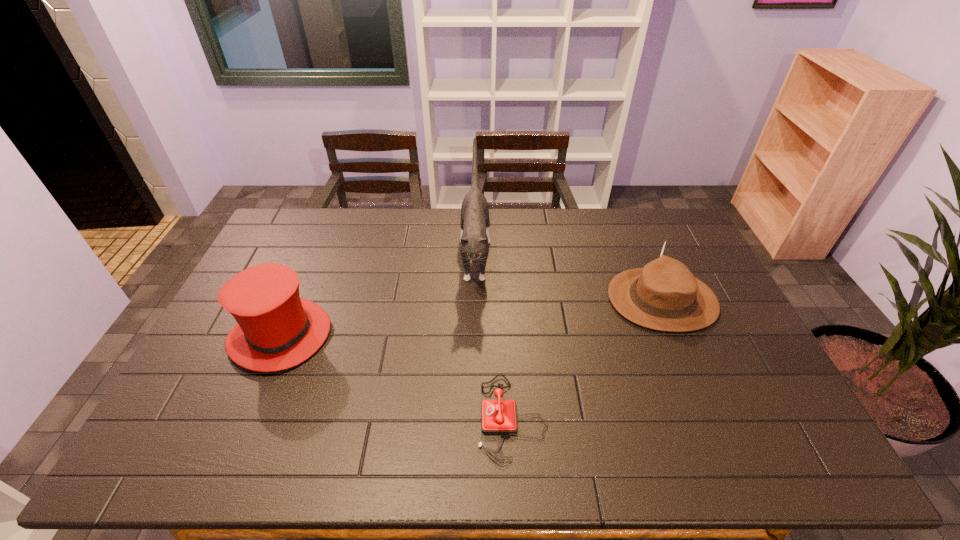
Where is `the tallest object`? the tallest object is located at coordinates (475, 224).

Image resolution: width=960 pixels, height=540 pixels. I want to click on hat, so click(276, 329).

This screenshot has width=960, height=540. I want to click on the leftmost object, so click(x=276, y=329).

You are a GUI agent. You are given a task and a screenshot of the screen. Output one action in this format:
    pyautogui.click(x=<x>, y=<y>)
    Task: Click on the third tallest object
    The image size is (960, 540).
    Given the screenshot: What is the action you would take?
    pyautogui.click(x=664, y=295)

At what (x,y) coordinates should I click in order to perform the action: click on fedora. Please return your answer as a coordinate pair (x, y). The width and height of the screenshot is (960, 540). Looking at the image, I should click on (664, 295).

Find the location of a particular element. The image size is (960, 540). telephone is located at coordinates (499, 416).

Identify the location of vacant space located at the face of the cat. (473, 390).

Locate an element on the screen. vacant space located on the back of the second tallest object is located at coordinates pos(313,259).

Locate an element on the screen. vacant area located on the feather side of the second shortest object is located at coordinates (570, 300).

Where is `free location located 0.080m on the feather side of the second shortest object`? free location located 0.080m on the feather side of the second shortest object is located at coordinates (583, 300).